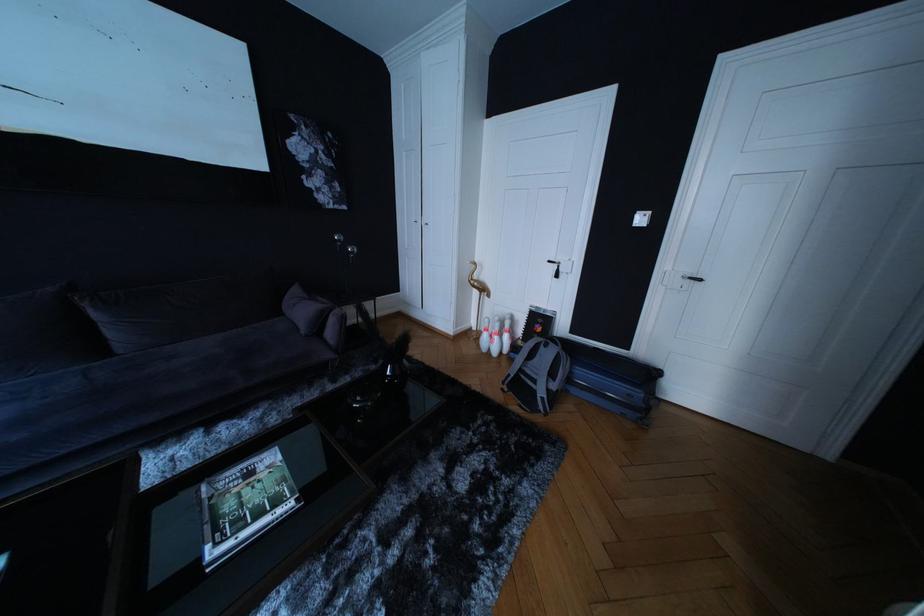
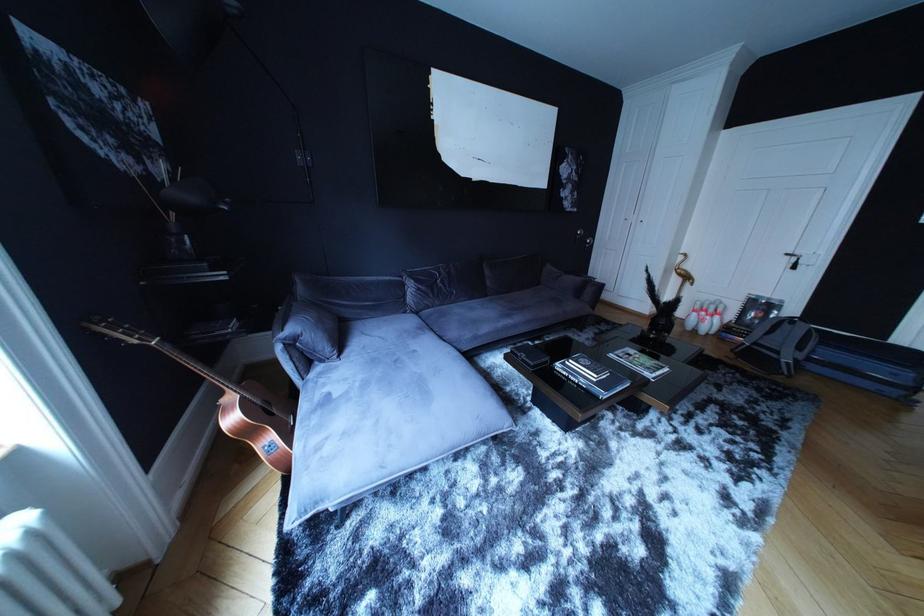
The images are taken continuously from a first-person perspective. In which direction are you moving?

The cameraman walked toward left, backward.